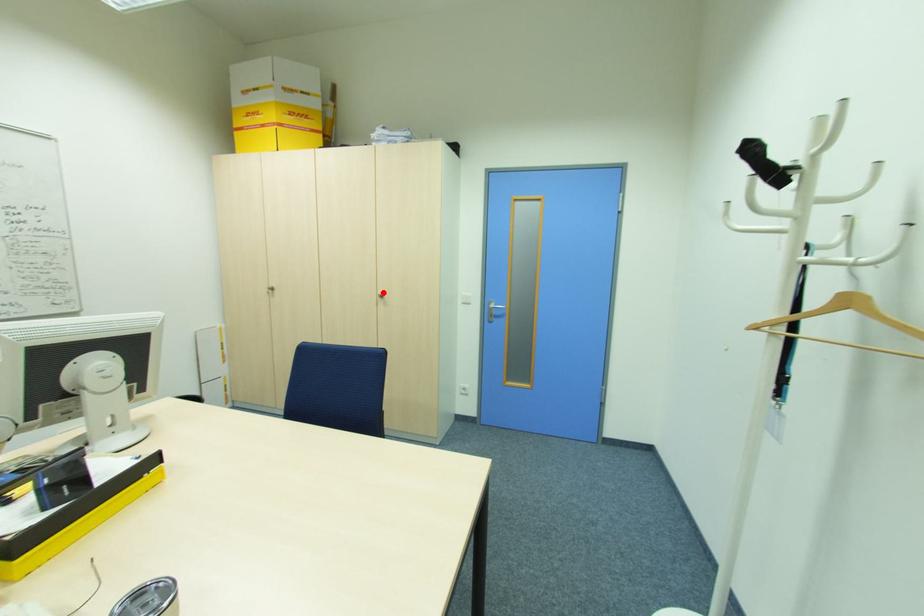
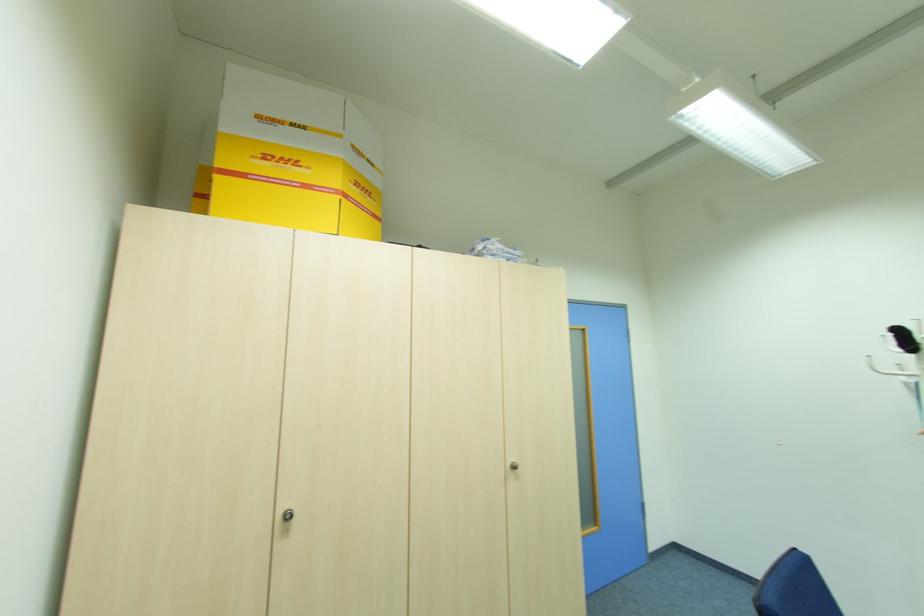
Locate, in the second image, the point that corresponds to the highlighted location in the first image.

(513, 460)